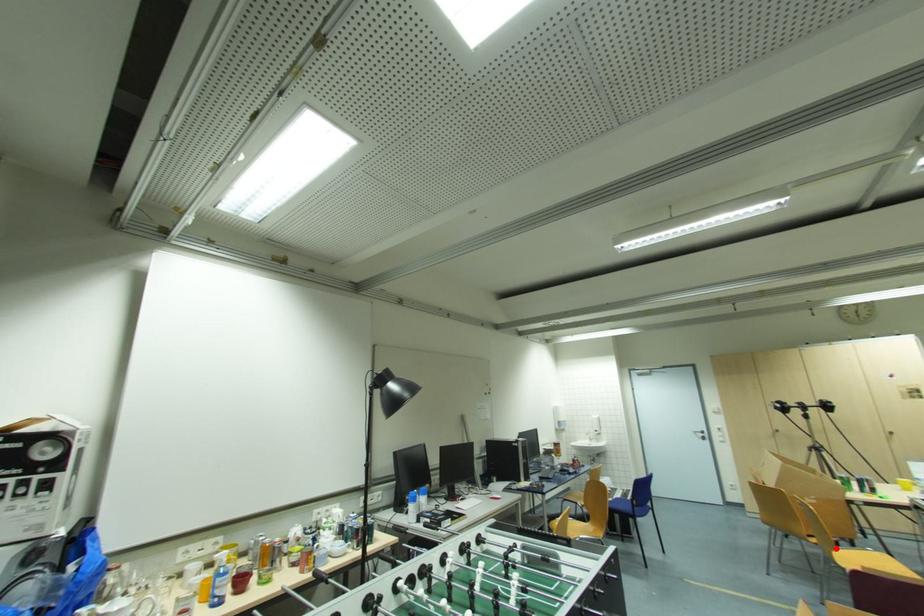
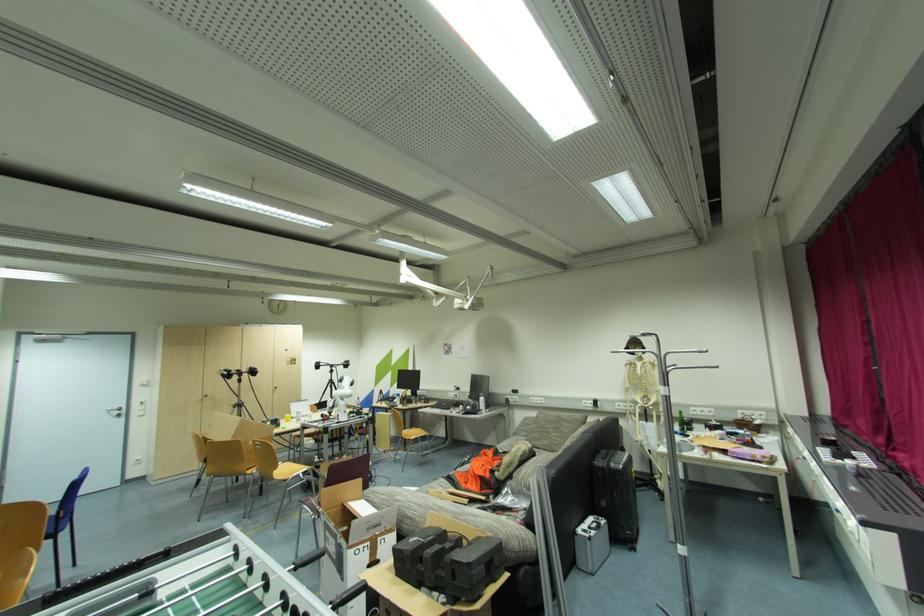
The point at the highlighted location is marked in the first image. Where is the corresponding point in the second image?

(280, 469)